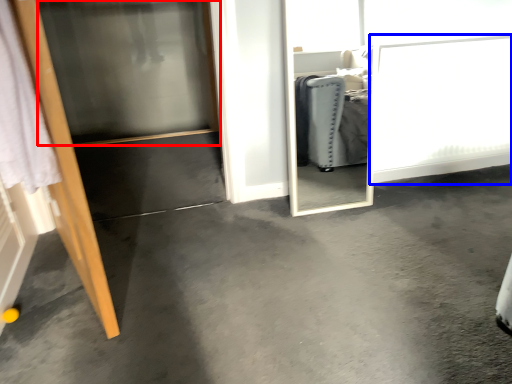
Question: Which object appears closest to the camera in this image, screen door (highlighted by a red box) or screen door (highlighted by a blue box)?

Choices:
 (A) screen door
 (B) screen door

Answer: (A)